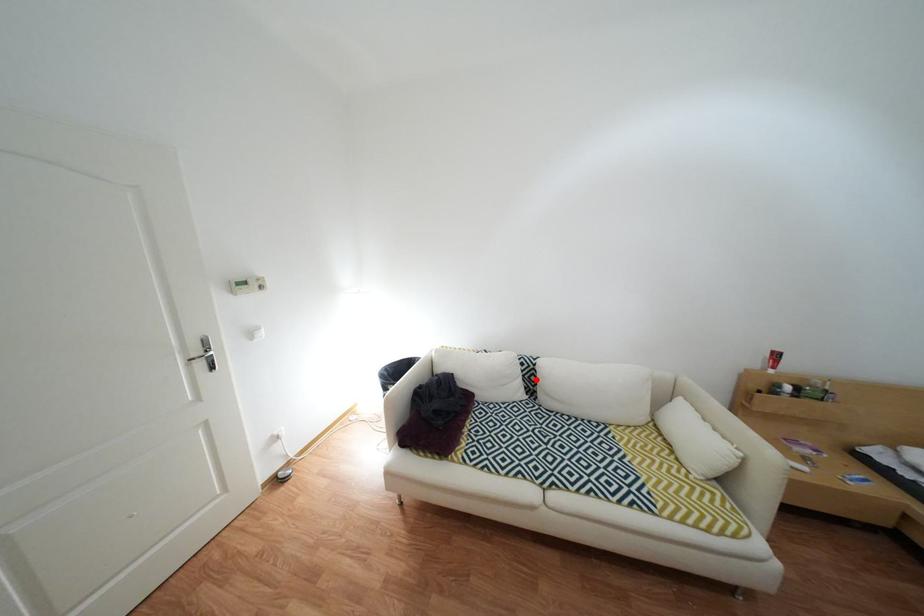
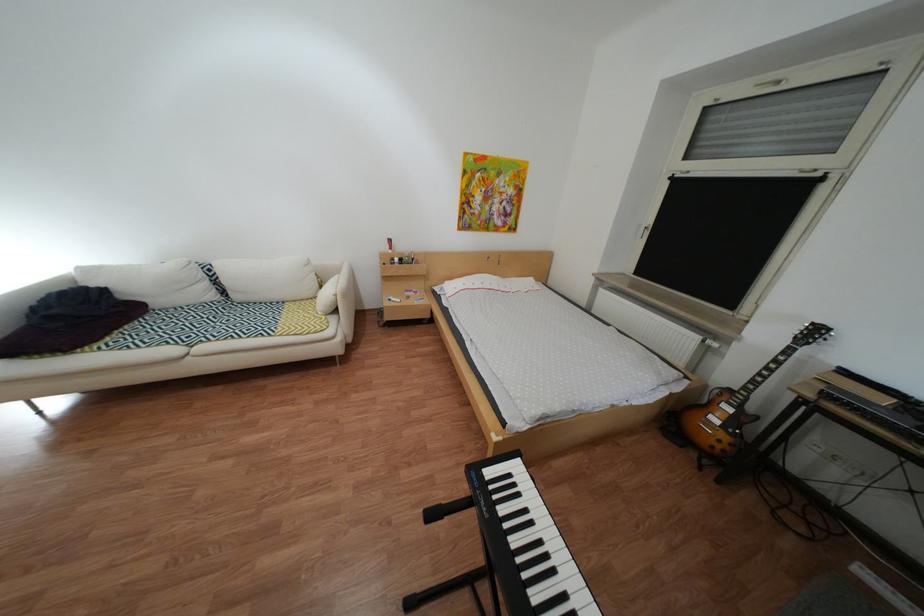
Locate, in the second image, the point that corresponds to the highlighted location in the first image.

(223, 284)